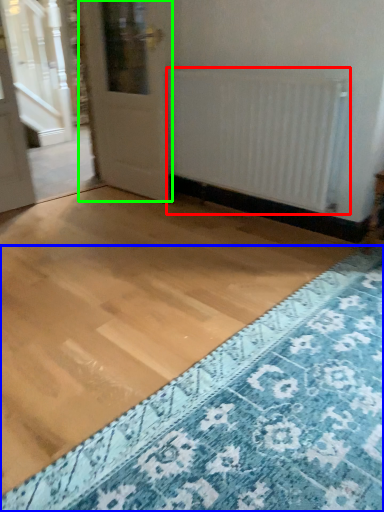
Question: Which object is positioned closest to radiator (highlighted by a red box)? Select from doormat (highlighted by a blue box) and door (highlighted by a green box).

Choices:
 (A) doormat
 (B) door

Answer: (B)